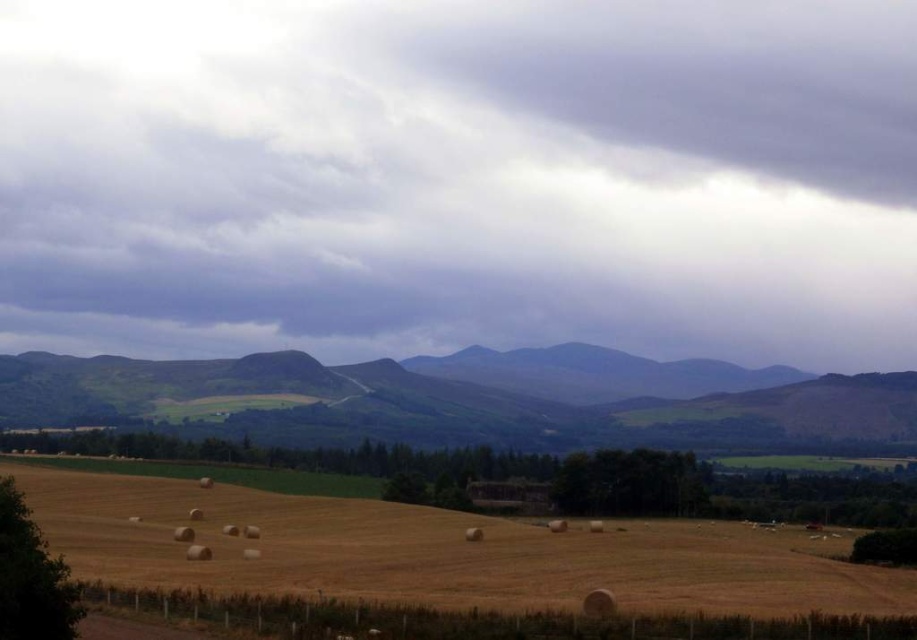
You are a photographer standing in the golden field and want to capture the gray cloudy sky at upper center and the green grassy hill at center in a single shot. Which object will occupy more vertical space in the photo?

The gray cloudy sky at upper center is much taller than the green grassy hill at center, so it will occupy more vertical space in the photo.

Based on the scene described, which object occupies a larger portion of the image between the gray cloudy sky at upper center and the yellow straw bales at lower center?

The gray cloudy sky at upper center occupies a larger portion of the image than the yellow straw bales at lower center.